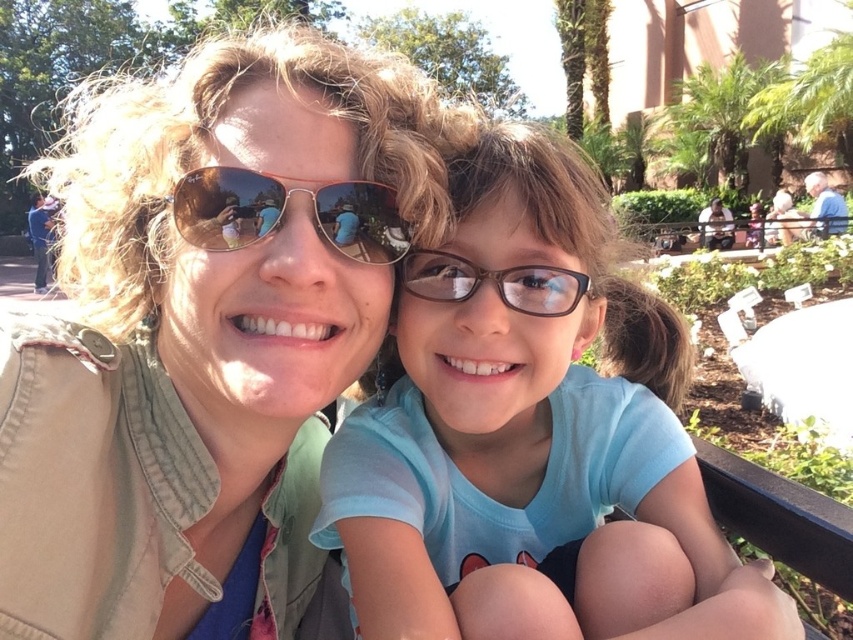
You are standing in a park and see two points marked in the image. The first point is at coordinate point(x=445, y=576) and the second is at point(x=374, y=195). If you want to walk towards the point that is further away from you, which coordinate should you head towards?

Point(x=445, y=576) is behind point(x=374, y=195), so you should head towards point(x=445, y=576) as it is further away from you.

You are a photographer trying to capture the gold reflective sunglasses at center in the image. The sunglasses are located at point coordinates of [283,211]. If you move your camera 0.1 units to the right along the x axis, will the sunglasses still be in the frame?

The point coordinates of the gold reflective sunglasses at center are [283,211]. Moving 0.1 units to the right along the x axis would shift the camera view, but since the sunglasses are at the center, they should remain within the frame unless the movement causes the camera to pan beyond the image boundaries. However, without knowing the exact frame boundaries, it is impossible to confirm definitively.

You are a photographer trying to focus on the light blue fabric shirt at center and the gold reflective sunglasses at center. Which object should you adjust your camera to focus on first if you want to capture both in the same frame without moving the camera?

You should focus on the gold reflective sunglasses at center first because the light blue fabric shirt at center is to the right of it, so adjusting focus on the sunglasses ensures both are within the frame.